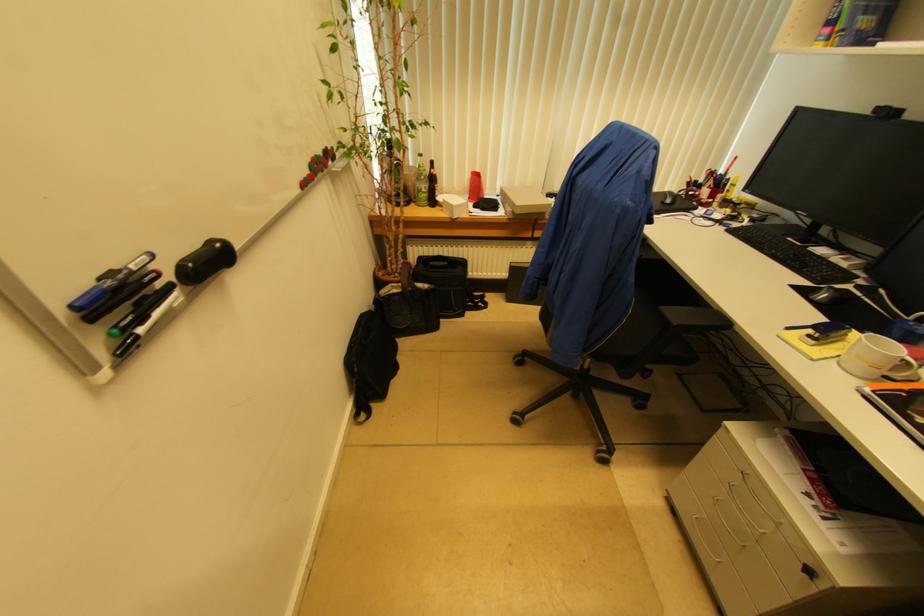
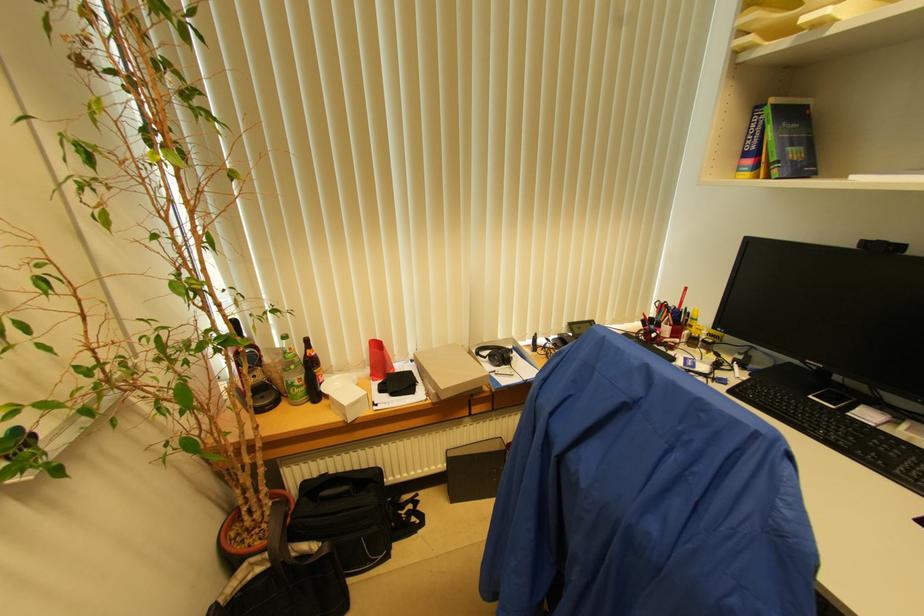
The point at (512, 265) is marked in the first image. Where is the corresponding point in the second image?

(447, 453)